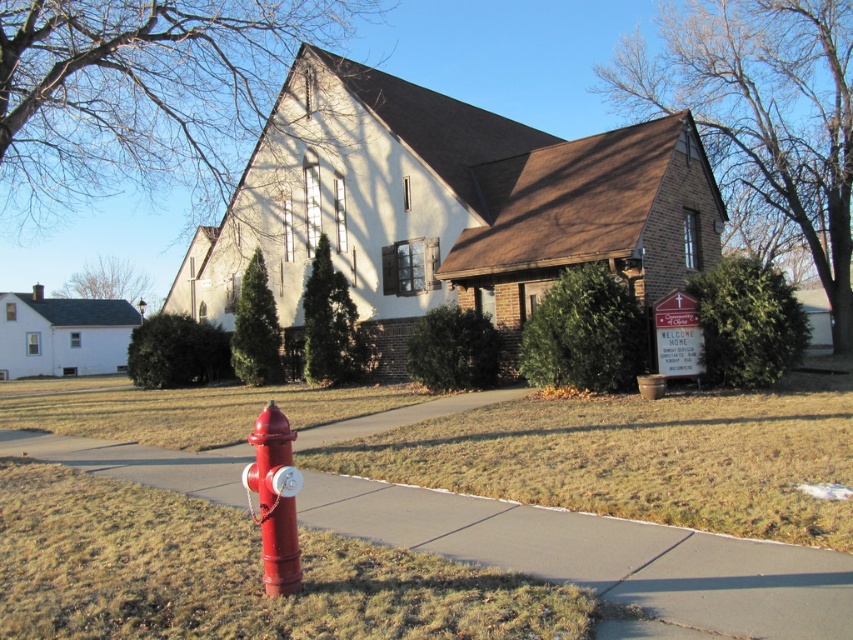
You are a delivery person trying to park your 1.5 meter wide delivery van near the church. The parking spot is located between the smooth concrete pavement at lower center and the shiny red fire hydrant at lower left. Can your van fit in the space between them?

The smooth concrete pavement at lower center is wider than the shiny red fire hydrant at lower left. However, the exact width of the parking space between them isn t specified in the objects description. The answer can t be determined with the given information.

You are a delivery person trying to place a heavy box on the ground near the shiny red fire hydrant at lower left. The box is 10 cm tall. Can you place it on the smooth concrete pavement at lower center without it being obstructed by the fire hydrant?

The smooth concrete pavement at lower center has a lesser height compared to shiny red fire hydrant at lower left, so the box can be placed there as the pavement is lower and the fire hydrant is taller, allowing enough space.

You are a delivery person approaching the church and need to park your vehicle on the smooth concrete pavement at lower center. However, there is a shiny red fire hydrant at lower left nearby. Can you safely park your vehicle without blocking the fire hydrant?

The smooth concrete pavement at lower center is larger in size than the shiny red fire hydrant at lower left, so there should be enough space to park the vehicle without blocking the hydrant.